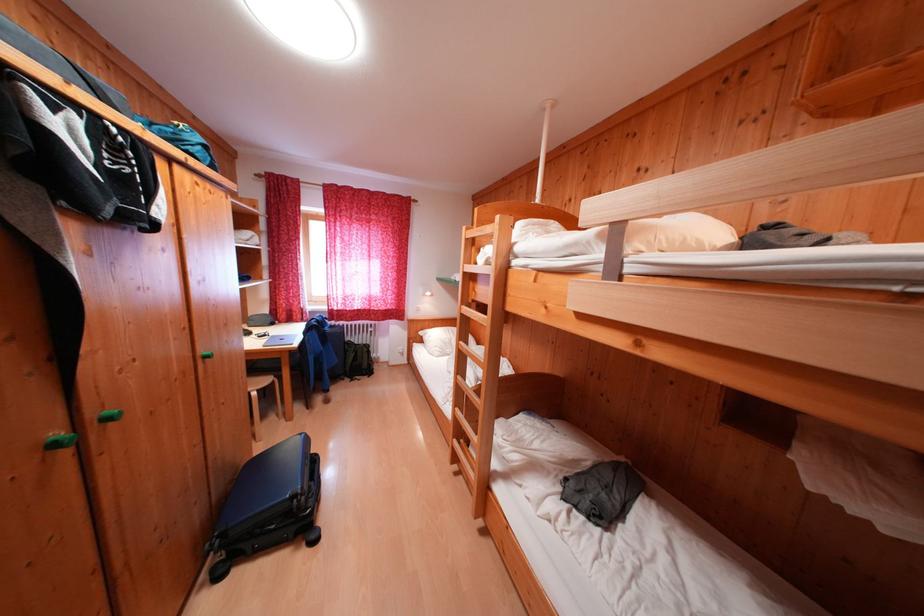
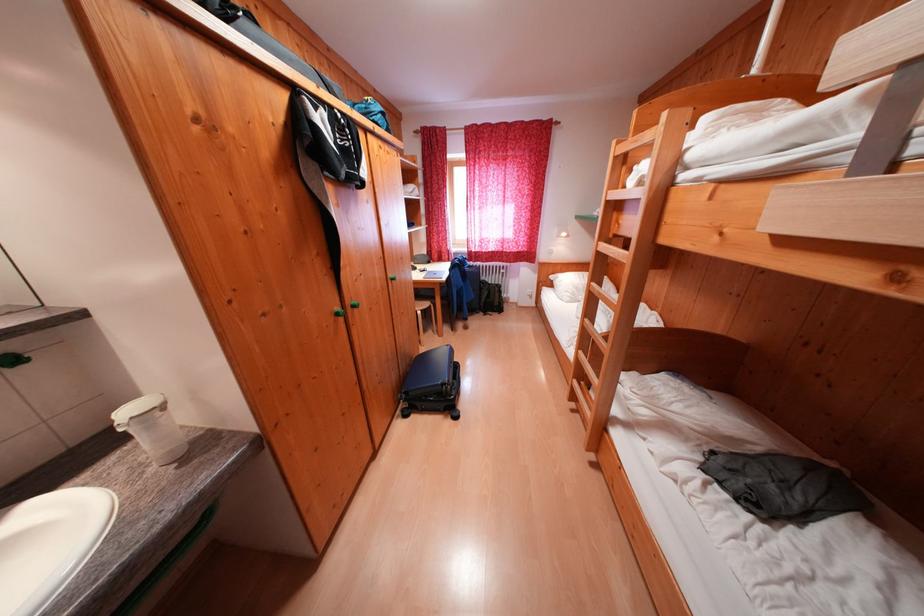
Locate, in the second image, the point that corresponds to point 456,345 in the first image.

(589, 291)